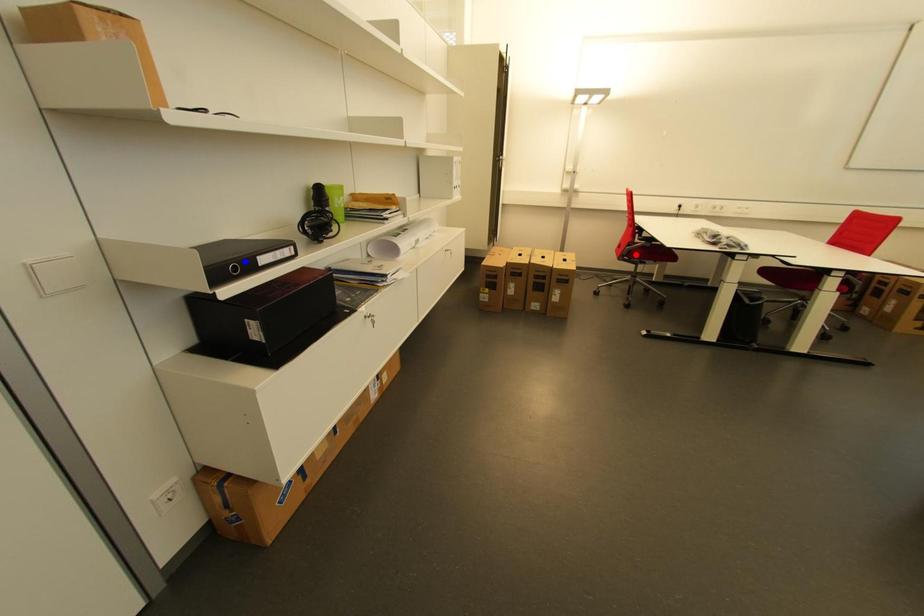
Question: In the image, two points are highlighted. Which point is nearer to the camera? Reply with the corresponding letter.

Choices:
 (A) blue point
 (B) red point

Answer: (A)